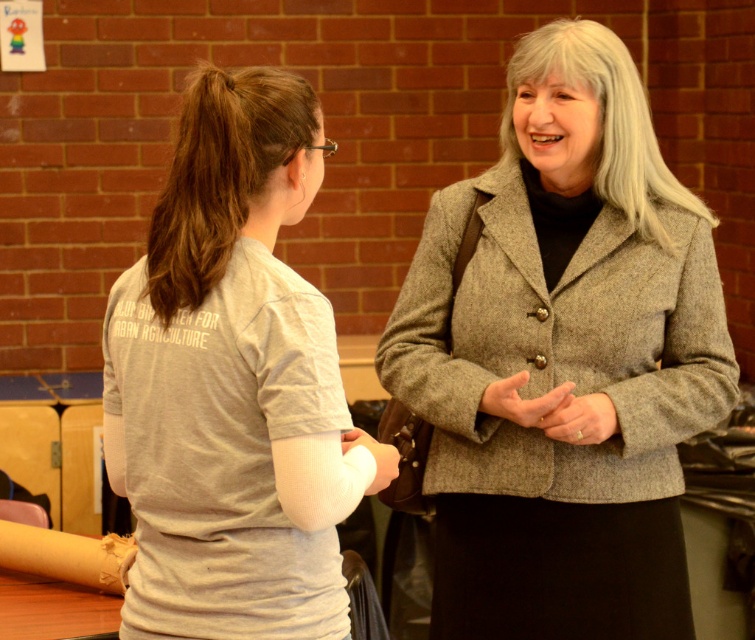
Who is positioned more to the right, matte gray blazer at center or gray cotton t-shirt at center?

matte gray blazer at center is more to the right.

Consider the image. Can you confirm if matte gray blazer at center is positioned above gray cotton t-shirt at center?

Correct, matte gray blazer at center is located above gray cotton t-shirt at center.

The image size is (755, 640). What do you see at coordinates (562, 358) in the screenshot? I see `matte gray blazer at center` at bounding box center [562, 358].

Where is `matte gray blazer at center`? The width and height of the screenshot is (755, 640). matte gray blazer at center is located at coordinates (562, 358).